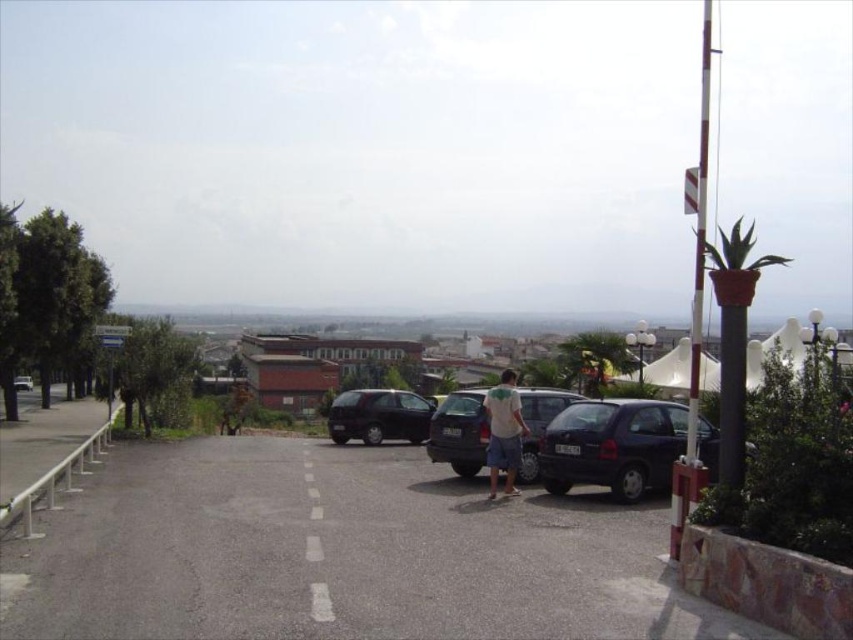
Between gray asphalt parking lot at center and white cotton shirt at center, which one appears on the right side from the viewer's perspective?

Positioned to the right is white cotton shirt at center.

Is point (363, 552) behind point (511, 435)?

No, (363, 552) is in front of (511, 435).

Where is `gray asphalt parking lot at center`? This screenshot has height=640, width=853. gray asphalt parking lot at center is located at coordinates (338, 554).

Who is shorter, gray asphalt parking lot at center or matte black van at left?

With less height is gray asphalt parking lot at center.

Is gray asphalt parking lot at center behind matte black van at left?

That is False.

Is point (640, 557) positioned before point (32, 381)?

Yes, point (640, 557) is closer to viewer.

This screenshot has height=640, width=853. In order to click on gray asphalt parking lot at center in this screenshot , I will do `click(338, 554)`.

Can you confirm if gray asphalt parking lot at center is positioned to the right of dark gray matte van at center?

Correct, you'll find gray asphalt parking lot at center to the right of dark gray matte van at center.

Which is in front, point (222, 612) or point (370, 442)?

Point (222, 612) is in front.

Find the location of a particular element. The height and width of the screenshot is (640, 853). gray asphalt parking lot at center is located at coordinates (338, 554).